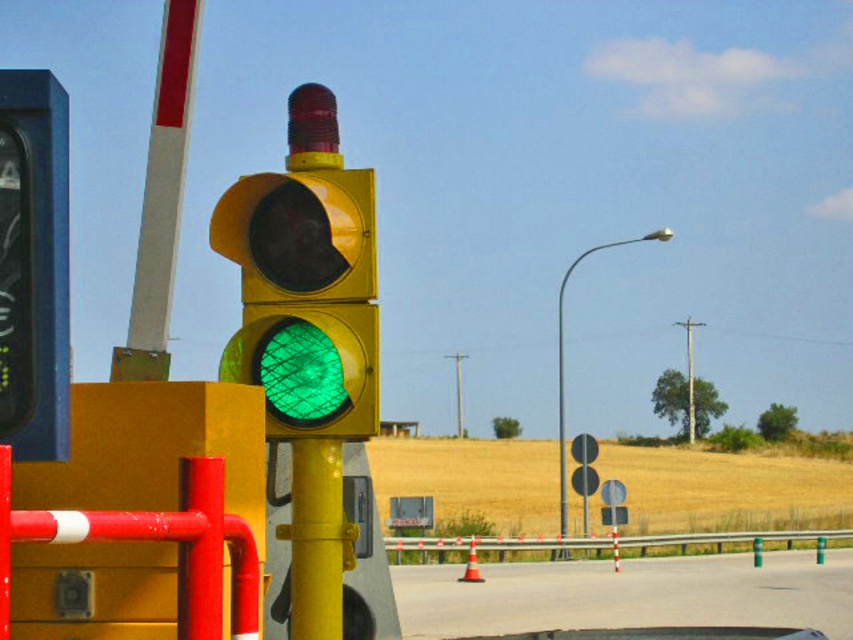
Who is higher up, yellow matte/glass traffic light at center or smooth asphalt highway at center?

yellow matte/glass traffic light at center is above.

Locate an element on the screen. The width and height of the screenshot is (853, 640). yellow matte/glass traffic light at center is located at coordinates click(x=305, y=298).

The height and width of the screenshot is (640, 853). What are the coordinates of `yellow matte/glass traffic light at center` in the screenshot? It's located at (305, 298).

Between point (294, 324) and point (456, 540), which one is positioned in front?

Positioned in front is point (294, 324).

Who is more distant from viewer, (289,310) or (721,547)?

Positioned behind is point (721,547).

Which is in front, point (265, 262) or point (791, 540)?

Point (265, 262)

Identify the location of yellow matte/glass traffic light at center. The width and height of the screenshot is (853, 640). (305, 298).

Between yellow matte/glass traffic light at center and smooth metal barricade at left, which one is positioned lower?

Positioned lower is smooth metal barricade at left.

Find the location of `yellow matte/glass traffic light at center`. yellow matte/glass traffic light at center is located at coordinates (305, 298).

Is point (323, 259) positioned behind point (56, 536)?

Yes, point (323, 259) is farther from viewer.

Where is `yellow matte/glass traffic light at center`? yellow matte/glass traffic light at center is located at coordinates (305, 298).